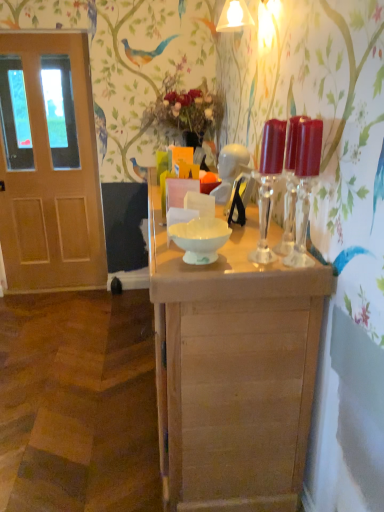
Where is `vacant space in front of white glossy bowl at center`? vacant space in front of white glossy bowl at center is located at coordinates (196, 276).